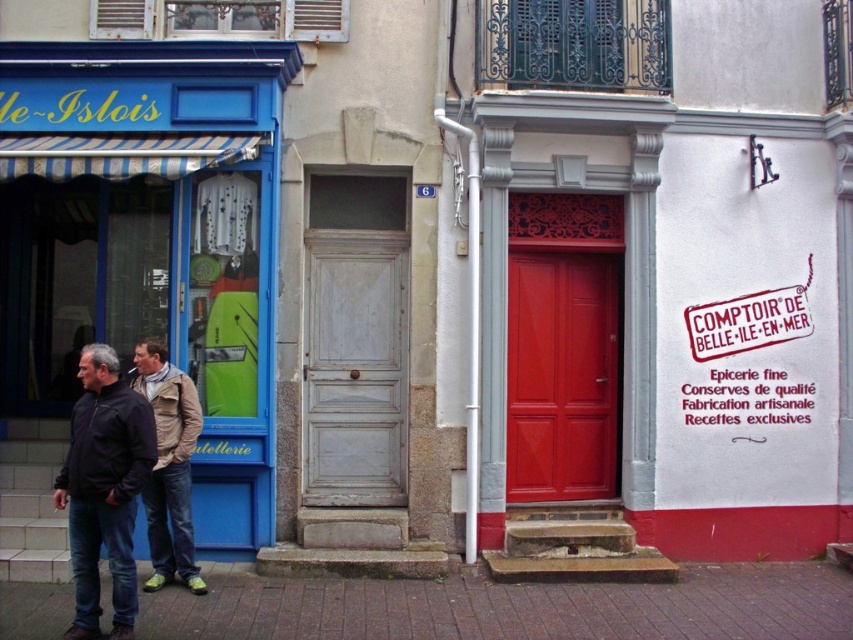
Question: Considering the real-world distances, which object is farthest from the rubber stamp sign at center?

Choices:
 (A) white wooden door at center
 (B) shiny red door at center
 (C) khaki fabric jacket at center
 (D) dark blue jeans at lower left

Answer: (D)

Question: Is matte blue storefront at left closer to camera compared to rubber stamp sign at center?

Choices:
 (A) no
 (B) yes

Answer: (B)

Question: Among these points, which one is nearest to the camera?

Choices:
 (A) (523, 416)
 (B) (312, 368)
 (C) (83, 547)
 (D) (146, 372)

Answer: (C)

Question: Among these points, which one is farthest from the camera?

Choices:
 (A) (219, 108)
 (B) (587, 374)
 (C) (368, 451)
 (D) (698, 356)

Answer: (B)

Question: Does matte blue storefront at left have a larger size compared to rubber stamp sign at center?

Choices:
 (A) yes
 (B) no

Answer: (A)

Question: Considering the relative positions of matte blue storefront at left and dark blue jeans at lower left in the image provided, where is matte blue storefront at left located with respect to dark blue jeans at lower left?

Choices:
 (A) left
 (B) right

Answer: (B)